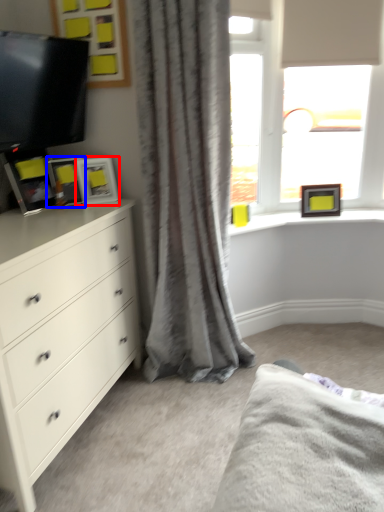
Question: Which point is closer to the camera, picture frame (highlighted by a red box) or picture frame (highlighted by a blue box)?

Choices:
 (A) picture frame
 (B) picture frame

Answer: (B)